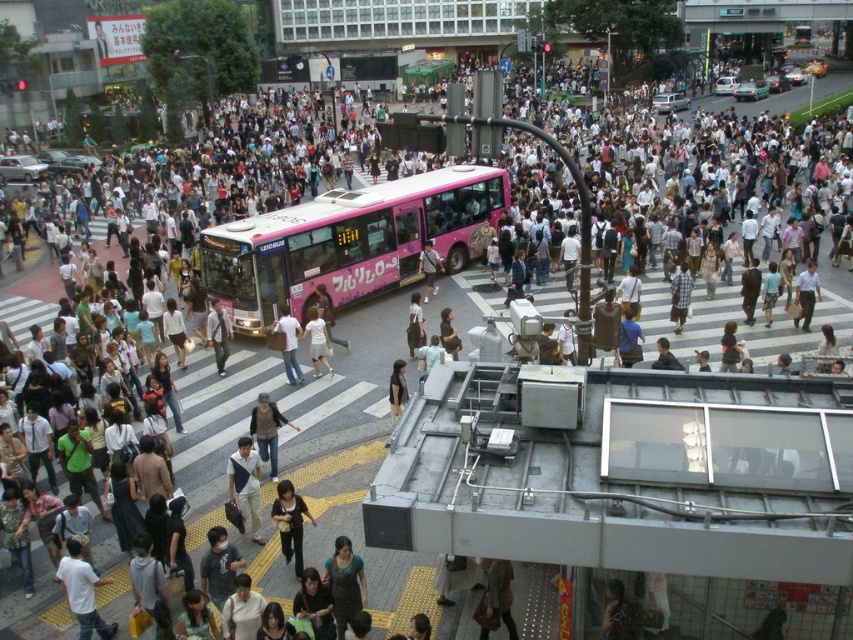
Question: Considering the relative positions of light blue shirt at center and white cotton shirt at center in the image provided, where is light blue shirt at center located with respect to white cotton shirt at center?

Choices:
 (A) right
 (B) left

Answer: (A)

Question: Can you confirm if light brown leather jacket at center is smaller than dark brown leather jacket at center?

Choices:
 (A) no
 (B) yes

Answer: (A)

Question: Which point is closer to the camera?

Choices:
 (A) (328, 368)
 (B) (221, 316)
 (C) (733, 632)
 (D) (289, 356)

Answer: (C)

Question: Which object is farther from the camera taking this photo?

Choices:
 (A) dark gray fabric bag at center
 (B) light brown leather jacket at center
 (C) white cotton dress at center

Answer: (B)

Question: Which of the following is the closest to the observer?

Choices:
 (A) (235, 480)
 (B) (683, 291)
 (C) (416, 179)
 (D) (207, 324)

Answer: (A)

Question: Is denim overalls at center thinner than light brown fabric pants at center?

Choices:
 (A) no
 (B) yes

Answer: (A)